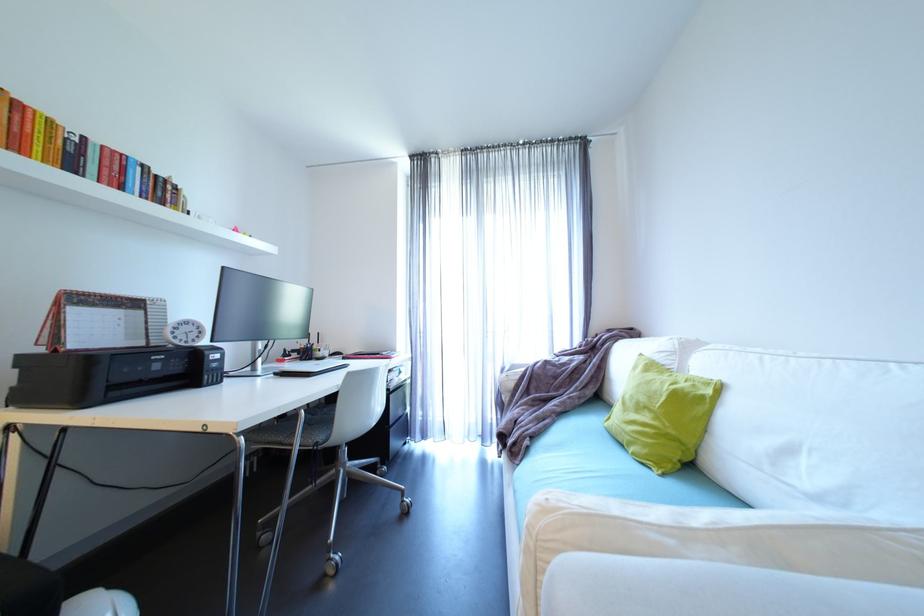
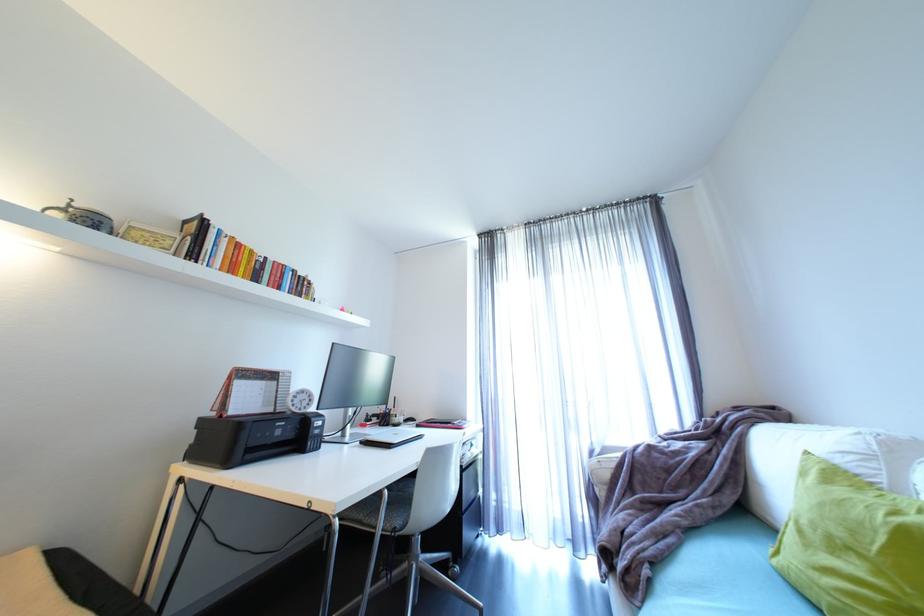
The point at (201,334) is marked in the first image. Where is the corresponding point in the second image?

(312, 402)